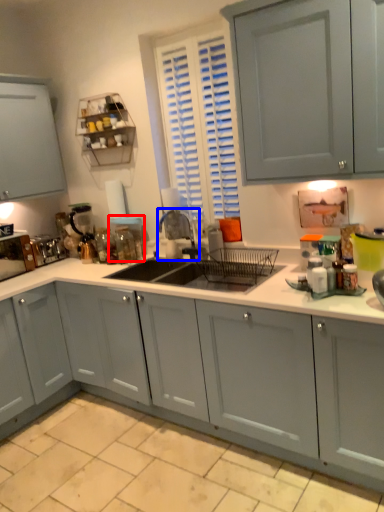
Question: Which object is closer to the camera taking this photo, appliance (highlighted by a red box) or faucet (highlighted by a blue box)?

Choices:
 (A) appliance
 (B) faucet

Answer: (B)